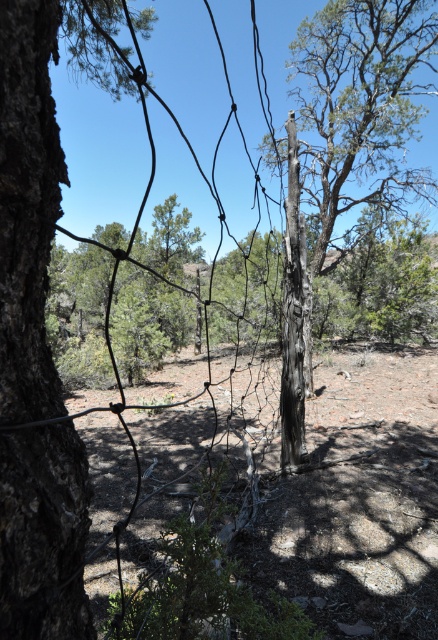
Which is behind, point (339, 365) or point (286, 296)?

Positioned behind is point (339, 365).

Is brown dirt field at center taller than charcoal textured tree trunk at center?

Incorrect, brown dirt field at center's height is not larger of charcoal textured tree trunk at center's.

Which is behind, point (317, 557) or point (285, 332)?

Positioned behind is point (285, 332).

Find the location of `brown dirt field at center`. brown dirt field at center is located at coordinates (353, 499).

Does dark brown bark tree trunk at left have a larger size compared to charcoal textured tree trunk at center?

No.

Which of these two, dark brown bark tree trunk at left or charcoal textured tree trunk at center, stands taller?

charcoal textured tree trunk at center is taller.

Image resolution: width=438 pixels, height=640 pixels. What are the coordinates of `dark brown bark tree trunk at left` in the screenshot? It's located at (28, 208).

How far apart are brown dirt field at center and charred wood tree at center?

brown dirt field at center and charred wood tree at center are 9.73 meters apart from each other.

I want to click on brown dirt field at center, so click(x=353, y=499).

You are a GUI agent. You are given a task and a screenshot of the screen. Output one action in this format:
    pyautogui.click(x=<x>, y=<y>)
    Task: Click on the brown dirt field at center
    This screenshot has height=640, width=438.
    Given the screenshot: What is the action you would take?
    pyautogui.click(x=353, y=499)